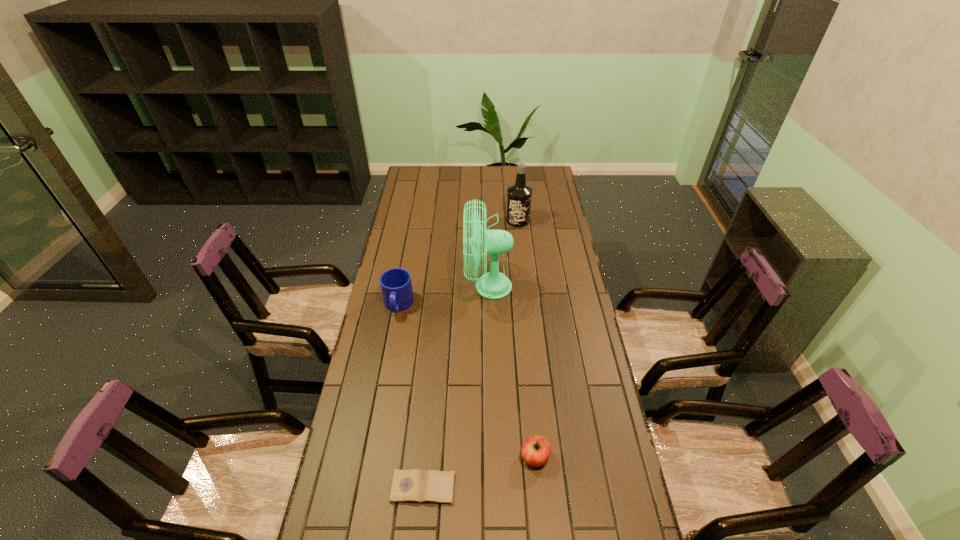
Identify which object is located as the third nearest to the second shortest object. Please provide its 2D coordinates. Your answer should be formatted as a tuple, i.e. [(x, y)], where the tuple contains the x and y coordinates of a point satisfying the conditions above.

[(396, 285)]

The height and width of the screenshot is (540, 960). Find the location of `the second closest object to the second shortest object`. the second closest object to the second shortest object is located at coordinates (493, 285).

Locate an element on the screen. vacant space that satisfies the following two spatial constraints: 1. in front of the second shortest object to blow air; 2. on the right side of the fan is located at coordinates (492, 457).

Image resolution: width=960 pixels, height=540 pixels. In order to click on free region that satisfies the following two spatial constraints: 1. on the side with the handle of the mug; 2. on the left side of the apple in this screenshot , I will do `click(370, 457)`.

Image resolution: width=960 pixels, height=540 pixels. In order to click on vacant space that satisfies the following two spatial constraints: 1. in front of the fan to blow air; 2. on the side with the handle of the mug in this screenshot , I will do `click(489, 305)`.

At what (x,y) coordinates should I click in order to perform the action: click on vacant point that satisfies the following two spatial constraints: 1. on the side with the handle of the leftmost object; 2. on the left side of the second object from left to right. Please return your answer as a coordinate pair (x, y). Looking at the image, I should click on (365, 488).